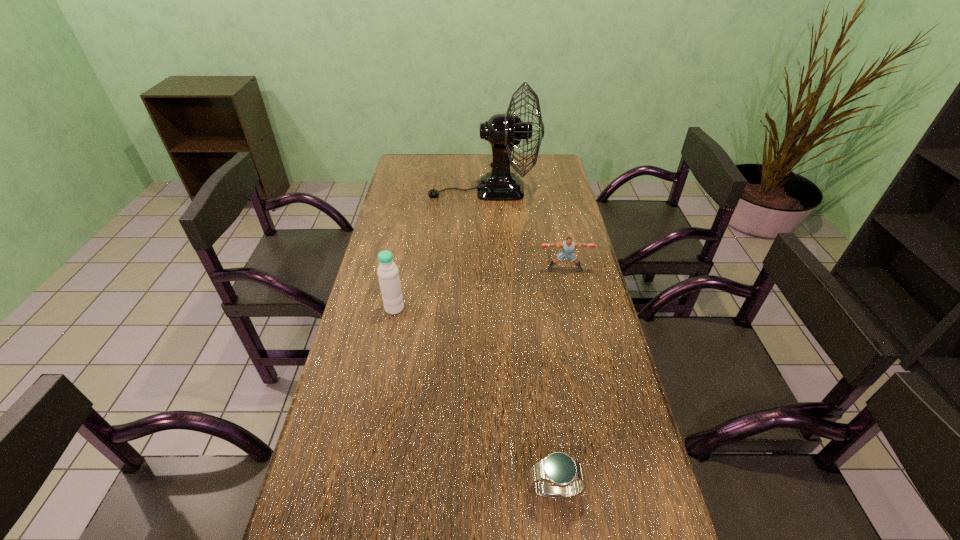
At what (x,y) coordinates should I click in order to perform the action: click on free location that satisfies the following two spatial constraints: 1. in front of the watch, indicating the direction of air flow; 2. on the left side of the farthest object. Please return your answer as a coordinate pair (x, y). This screenshot has width=960, height=540. Looking at the image, I should click on (487, 491).

You are a GUI agent. You are given a task and a screenshot of the screen. Output one action in this format:
    pyautogui.click(x=<x>, y=<y>)
    Task: Click on the free space that satisfies the following two spatial constraints: 1. in front of the tallest object, indicating the direction of air flow; 2. on the left side of the nearest object
    
    Given the screenshot: What is the action you would take?
    pyautogui.click(x=487, y=491)